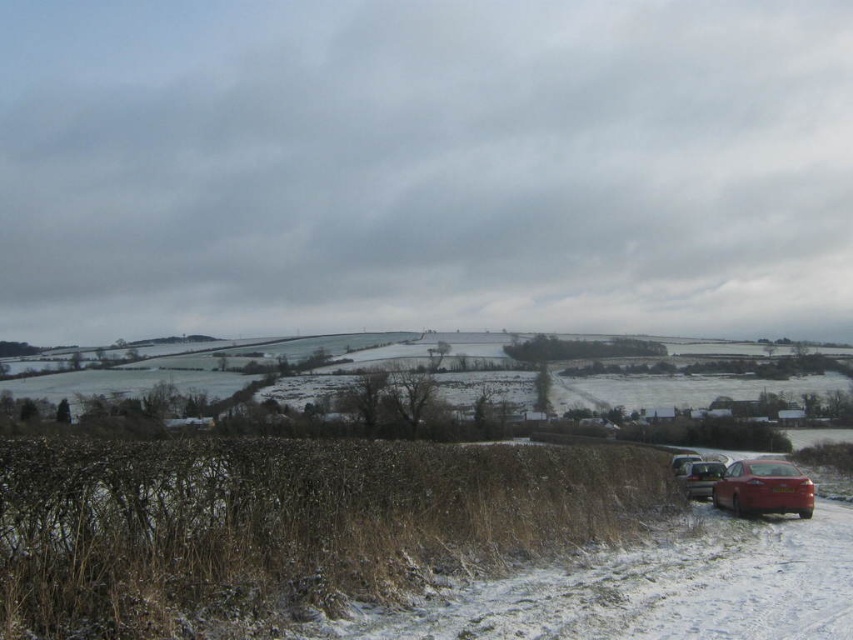
Does shiny red car at lower right have a larger size compared to metallic silver car at lower right?

Correct, shiny red car at lower right is larger in size than metallic silver car at lower right.

From the picture: Which is more to the left, shiny red car at lower right or metallic silver car at lower right?

metallic silver car at lower right

Between point (729, 484) and point (685, 474), which one is positioned behind?

Positioned behind is point (685, 474).

The width and height of the screenshot is (853, 640). I want to click on shiny red car at lower right, so click(x=763, y=488).

Is smooth asphalt road at lower right smaller than metallic silver car at lower right?

Incorrect, smooth asphalt road at lower right is not smaller in size than metallic silver car at lower right.

How far apart are smooth asphalt road at lower right and metallic silver car at lower right?

6.39 meters

Identify the location of smooth asphalt road at lower right. (283, 524).

Image resolution: width=853 pixels, height=640 pixels. Describe the element at coordinates (283, 524) in the screenshot. I see `smooth asphalt road at lower right` at that location.

Does smooth asphalt road at lower right appear on the left side of shiny red car at lower right?

Yes, smooth asphalt road at lower right is to the left of shiny red car at lower right.

Does point (328, 593) lie in front of point (778, 465)?

Yes, point (328, 593) is closer to viewer.

Locate an element on the screen. Image resolution: width=853 pixels, height=640 pixels. smooth asphalt road at lower right is located at coordinates (283, 524).